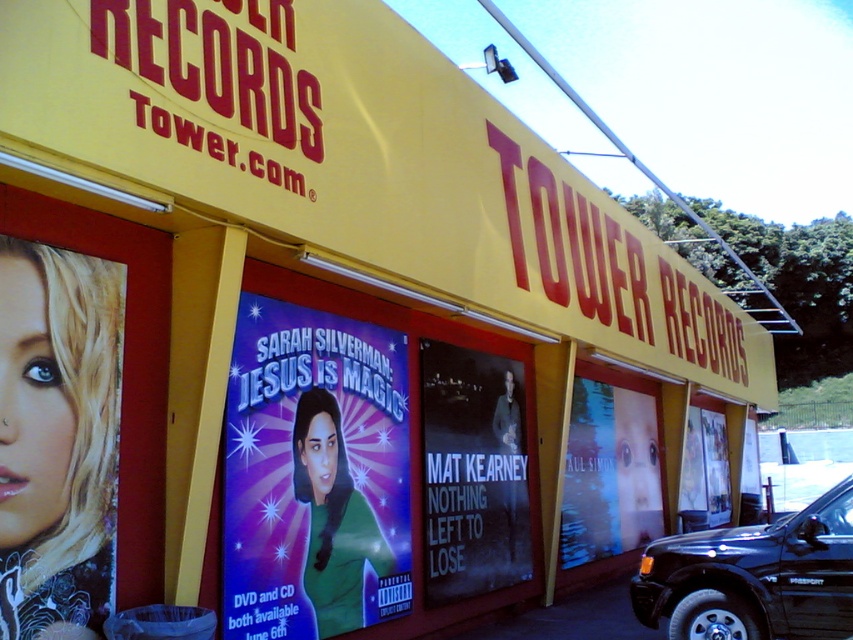
Question: Is black glossy suv at lower right smaller than blue glossy poster at center?

Choices:
 (A) no
 (B) yes

Answer: (A)

Question: Is black matte poster at center below black matte truck at right?

Choices:
 (A) yes
 (B) no

Answer: (B)

Question: Which point is closer to the camera?

Choices:
 (A) (805, 460)
 (B) (105, 593)
 (C) (483, 362)

Answer: (B)

Question: Which object is closer to the camera taking this photo?

Choices:
 (A) black matte truck at right
 (B) green matte poster at center

Answer: (B)

Question: Which object is the closest to the black glossy suv at lower right?

Choices:
 (A) purple glossy poster at center
 (B) blue glossy poster at center

Answer: (B)

Question: Is black glossy suv at lower right thinner than white glossy poster at center?

Choices:
 (A) no
 (B) yes

Answer: (A)